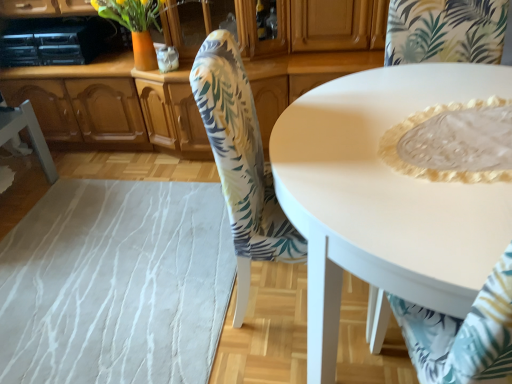
Question: Which direction should I rotate to face floral fabric chair at center, the second chair viewed from the right, — up or down?

Choices:
 (A) up
 (B) down

Answer: (A)

Question: Is white fabric chair at lower left, placed as the 3th chair when sorted from right to left, facing away from white lace tablecloth at lower right, which ranks as the first chair in right-to-left order?

Choices:
 (A) no
 (B) yes

Answer: (A)

Question: Does white fabric chair at lower left, placed as the 3th chair when sorted from right to left, have a lesser width compared to white lace tablecloth at lower right, which ranks as the first chair in right-to-left order?

Choices:
 (A) yes
 (B) no

Answer: (A)

Question: From a real-world perspective, does white fabric chair at lower left, placed as the 3th chair when sorted from right to left, sit lower than white lace tablecloth at lower right, the third chair in the left-to-right sequence?

Choices:
 (A) yes
 (B) no

Answer: (A)

Question: From the image's perspective, is white fabric chair at lower left, placed as the 3th chair when sorted from right to left, located beneath white lace tablecloth at lower right, which ranks as the first chair in right-to-left order?

Choices:
 (A) yes
 (B) no

Answer: (B)

Question: Is white fabric chair at lower left, placed as the 3th chair when sorted from right to left, touching white lace tablecloth at lower right, which ranks as the first chair in right-to-left order?

Choices:
 (A) no
 (B) yes

Answer: (A)

Question: Is white lace tablecloth at lower right, which ranks as the first chair in right-to-left order, inside white fabric chair at lower left, placed as the 3th chair when sorted from right to left?

Choices:
 (A) no
 (B) yes

Answer: (A)

Question: Does wooden cabinet at center have a larger size compared to white glossy table at center?

Choices:
 (A) yes
 (B) no

Answer: (A)

Question: Considering the relative positions of wooden cabinet at center and white glossy table at center in the image provided, is wooden cabinet at center behind white glossy table at center?

Choices:
 (A) no
 (B) yes

Answer: (B)

Question: Does wooden cabinet at center have a lesser height compared to white glossy table at center?

Choices:
 (A) yes
 (B) no

Answer: (B)

Question: Is wooden cabinet at center wider than white glossy table at center?

Choices:
 (A) yes
 (B) no

Answer: (B)

Question: Is wooden cabinet at center at the right side of white glossy table at center?

Choices:
 (A) yes
 (B) no

Answer: (B)

Question: From a real-world perspective, is wooden cabinet at center physically below white glossy table at center?

Choices:
 (A) no
 (B) yes

Answer: (A)

Question: Is wooden cabinet at center not close to white lace tablecloth at lower right, the third chair in the left-to-right sequence?

Choices:
 (A) yes
 (B) no

Answer: (A)